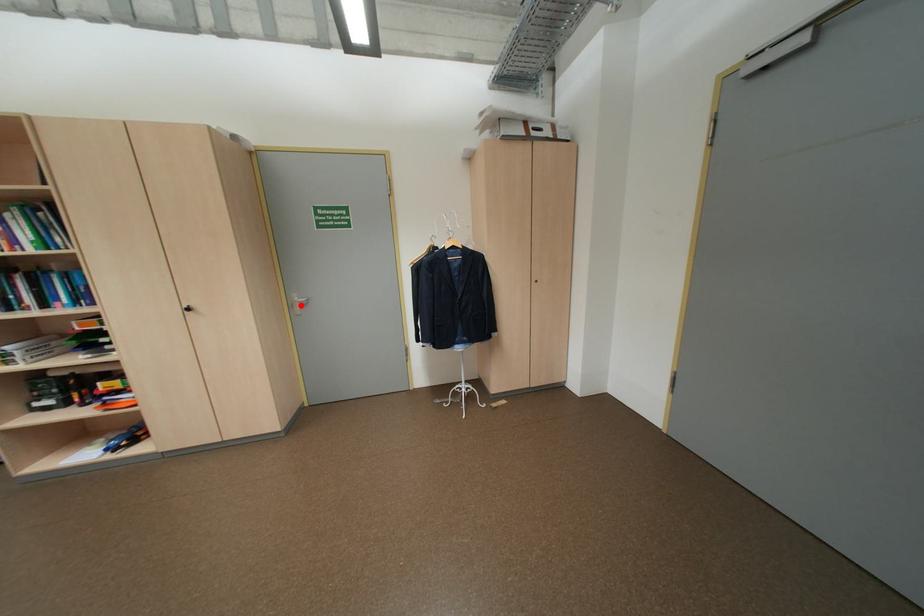
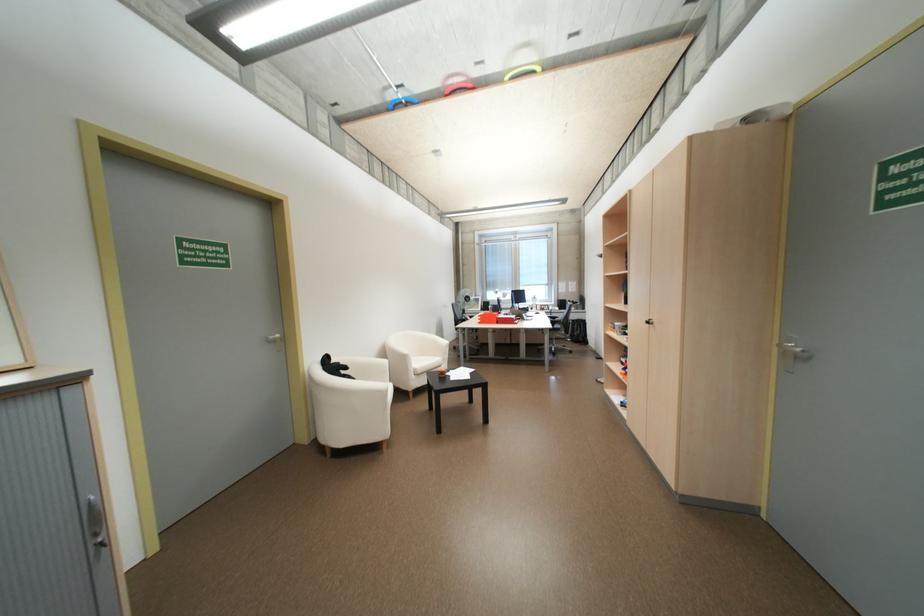
The point at the highlighted location is marked in the first image. Where is the corresponding point in the second image?

(795, 353)